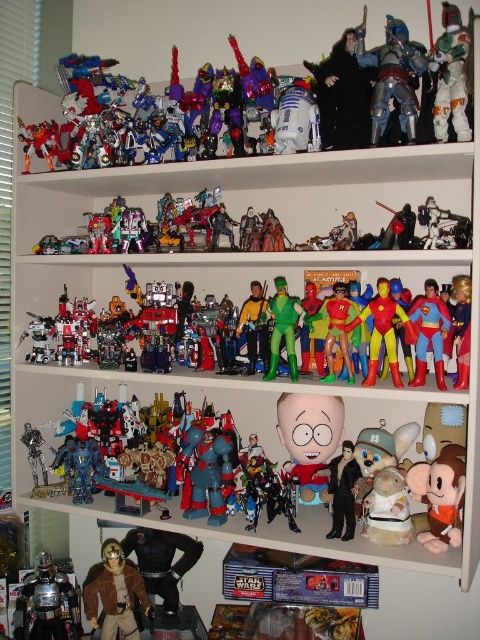
Is superman figure at center thinner than multicolored plastic action figure at center?

Indeed, superman figure at center has a lesser width compared to multicolored plastic action figure at center.

Is superman figure at center positioned at the back of multicolored plastic action figure at center?

No, superman figure at center is in front of multicolored plastic action figure at center.

What are the coordinates of `superman figure at center` in the screenshot? It's located at (429, 332).

Where is `superman figure at center`? superman figure at center is located at coordinates (429, 332).

Is metallic silver armor at upper right smaller than green rubber toy at center?

No.

Is metallic silver armor at upper right behind green rubber toy at center?

No.

Between point (396, 44) and point (277, 333), which one is positioned behind?

The point (277, 333) is more distant.

Locate an element on the screen. The height and width of the screenshot is (640, 480). metallic silver armor at upper right is located at coordinates (392, 76).

Is the position of shiny metallic robot at center less distant than that of green rubber toy at center?

Yes.

Is point (417, 394) less distant than point (292, 342)?

Yes, point (417, 394) is in front of point (292, 342).

Locate an element on the screen. shiny metallic robot at center is located at coordinates (300, 406).